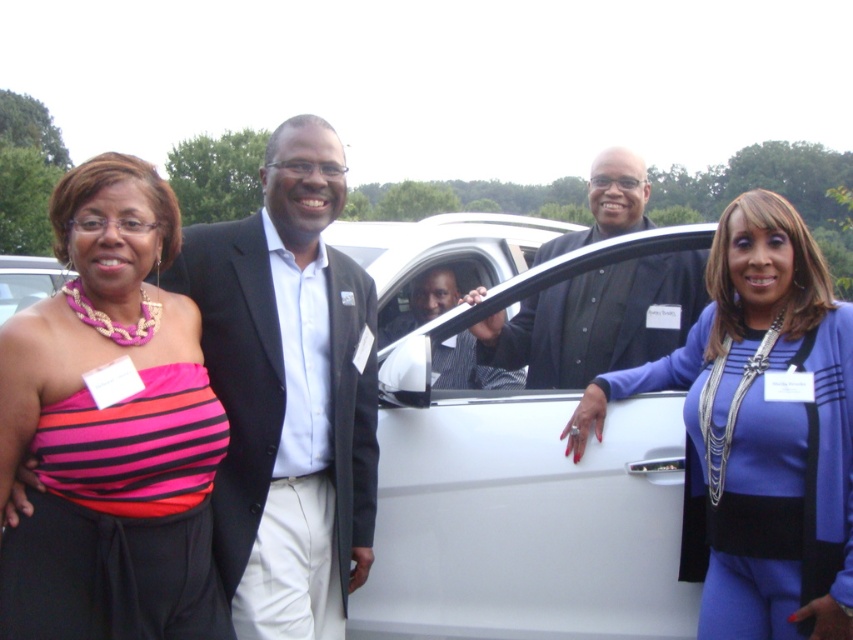
Question: Observing the image, what is the correct spatial positioning of white matte car at center in reference to black glossy suit at center?

Choices:
 (A) right
 (B) left

Answer: (B)

Question: Among these points, which one is farthest from the camera?

Choices:
 (A) (556, 611)
 (B) (67, 358)
 (C) (786, 609)

Answer: (A)

Question: Which object appears farthest from the camera in this image?

Choices:
 (A) black glossy suit at center
 (B) pink striped fabric at left
 (C) blue satin dress at right

Answer: (A)

Question: Considering the relative positions of blue satin dress at right and black glossy suit at center in the image provided, where is blue satin dress at right located with respect to black glossy suit at center?

Choices:
 (A) above
 (B) below

Answer: (B)

Question: Can you confirm if white matte car at center is wider than blue satin dress at right?

Choices:
 (A) yes
 (B) no

Answer: (A)

Question: Which point is closer to the camera?

Choices:
 (A) pink striped fabric at left
 (B) black glossy suit at center

Answer: (A)